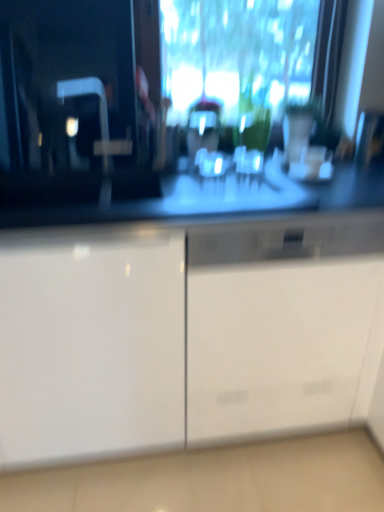
The height and width of the screenshot is (512, 384). In order to click on vacant space underneath white glossy cabinet at center (from a real-world perspective) in this screenshot , I will do `click(269, 449)`.